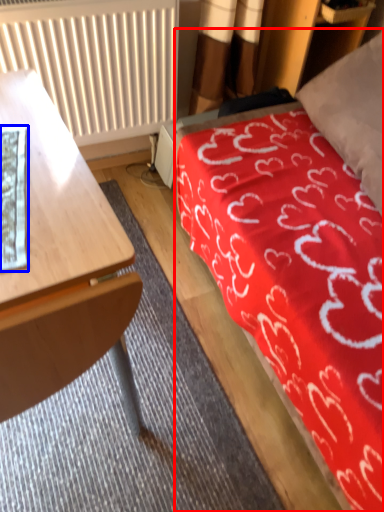
Question: Which of the following is the farthest to the observer, bed (highlighted by a red box) or sheet (highlighted by a blue box)?

Choices:
 (A) bed
 (B) sheet

Answer: (B)